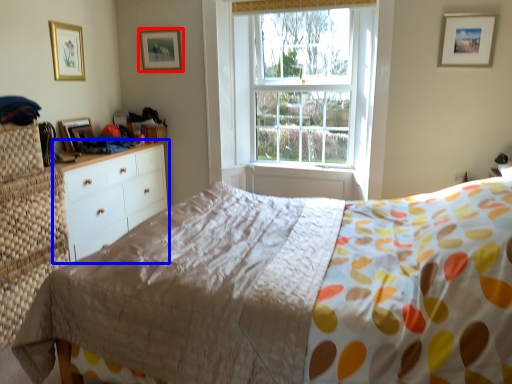
Question: Which object is further to the camera taking this photo, picture frame (highlighted by a red box) or chest of drawers (highlighted by a blue box)?

Choices:
 (A) picture frame
 (B) chest of drawers

Answer: (A)